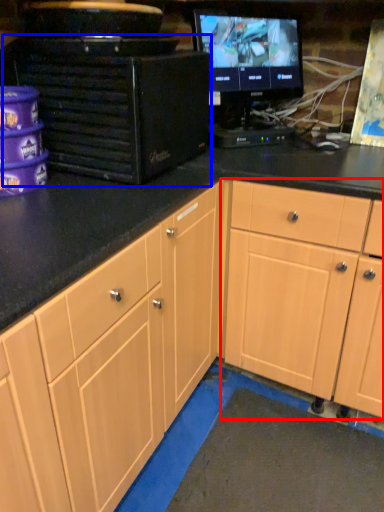
Question: Which object is further to the camera taking this photo, cabinetry (highlighted by a red box) or desktop computer (highlighted by a blue box)?

Choices:
 (A) cabinetry
 (B) desktop computer

Answer: (A)